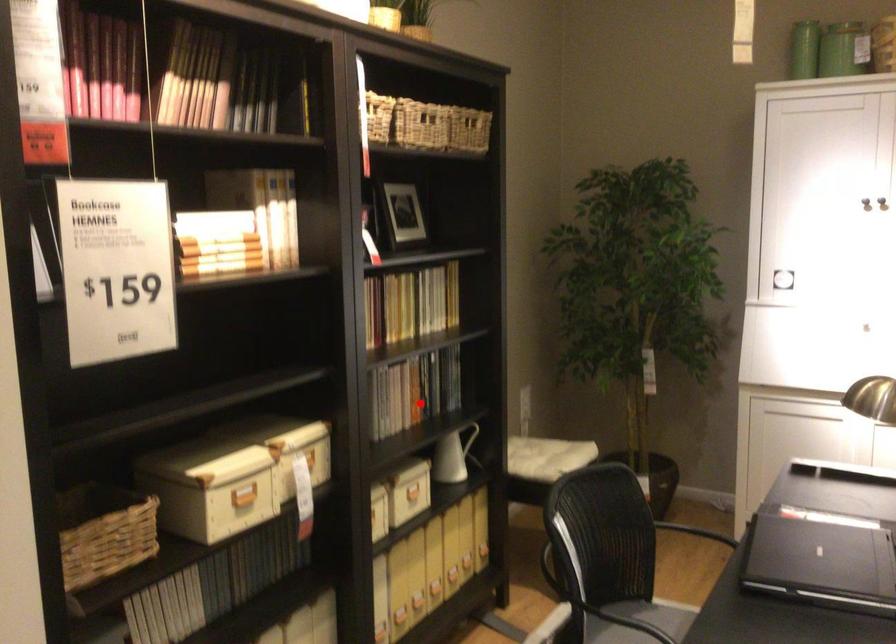
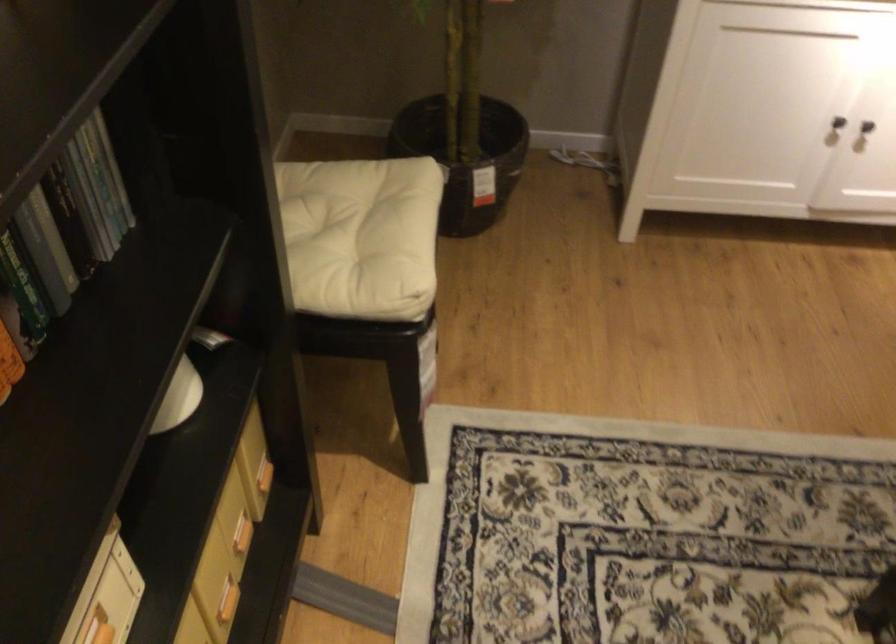
In the second image, find the point that corresponds to the highlighted location in the first image.

(22, 288)